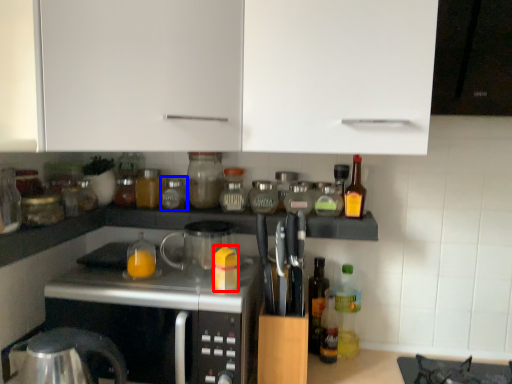
Question: Among these objects, which one is nearest to the camera, orange juice (highlighted by a red box) or bottle (highlighted by a blue box)?

Choices:
 (A) orange juice
 (B) bottle

Answer: (A)